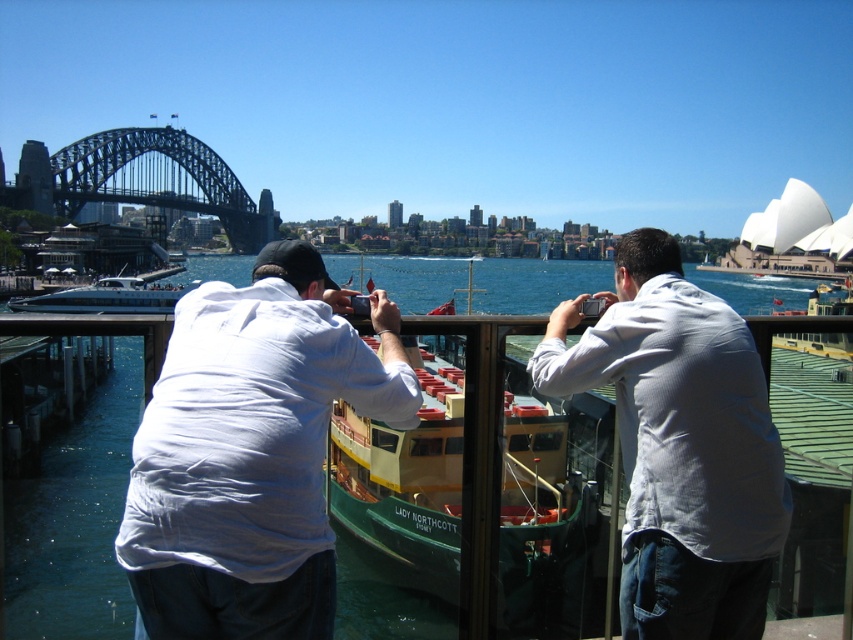
Question: Considering the real-world distances, which object is farthest from the green matte ferry at center?

Choices:
 (A) light blue shirt at center
 (B) blue water at center
 (C) white glossy ferry at lower left

Answer: (C)

Question: Which point is farther to the camera?

Choices:
 (A) blue water at center
 (B) white glossy ferry at lower left
 (C) green matte ferry at center

Answer: (B)

Question: Is white matte shirt at center positioned at the back of green matte ferry at center?

Choices:
 (A) yes
 (B) no

Answer: (B)

Question: Is green matte ferry at center further to camera compared to blue water at center?

Choices:
 (A) yes
 (B) no

Answer: (A)

Question: Is blue water at center below white glossy ferry at lower left?

Choices:
 (A) yes
 (B) no

Answer: (B)

Question: Estimate the real-world distances between objects in this image. Which object is farther from the white glossy ferry at lower left?

Choices:
 (A) light blue shirt at center
 (B) blue water at center
 (C) green matte ferry at center
 (D) white matte shirt at center

Answer: (A)